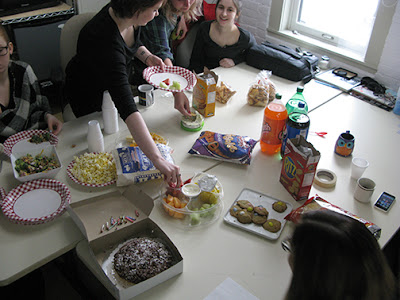
This screenshot has width=400, height=300. Find the location of `phone`. phone is located at coordinates (382, 200).